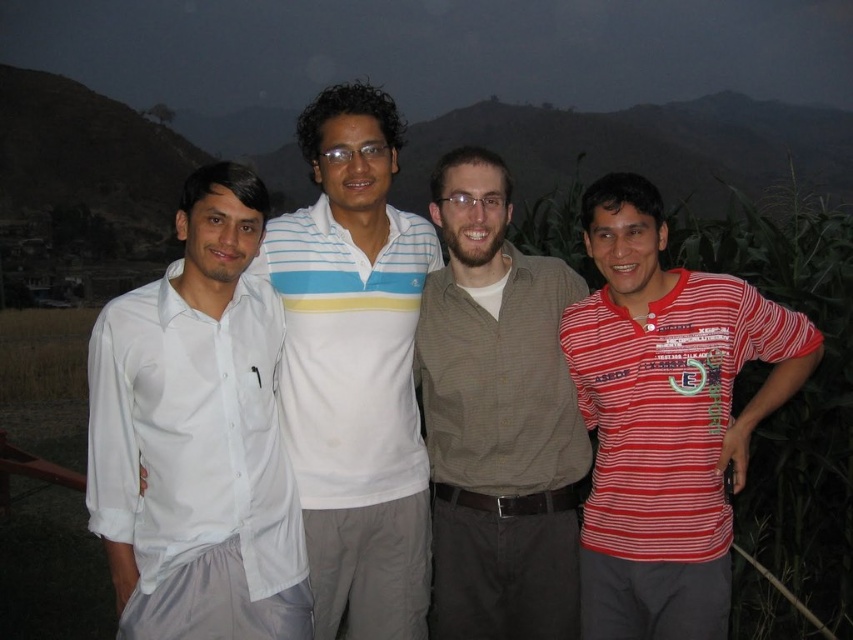
Question: Does white striped polo shirt at center appear on the right side of brown textured shirt at center?

Choices:
 (A) no
 (B) yes

Answer: (A)

Question: Which point is closer to the camera?

Choices:
 (A) (550, 536)
 (B) (291, 499)
 (C) (334, 227)
 (D) (671, 310)

Answer: (D)

Question: Which point is closer to the camera?

Choices:
 (A) (601, 205)
 (B) (321, 218)

Answer: (A)

Question: Is red striped shirt at right bigger than white cotton shirt at left?

Choices:
 (A) no
 (B) yes

Answer: (B)

Question: Does red striped shirt at right have a larger size compared to white striped polo shirt at center?

Choices:
 (A) yes
 (B) no

Answer: (B)

Question: Which point is farther from the camera taking this photo?

Choices:
 (A) (671, 390)
 (B) (556, 630)
 (C) (293, 404)
 (D) (213, 403)

Answer: (C)